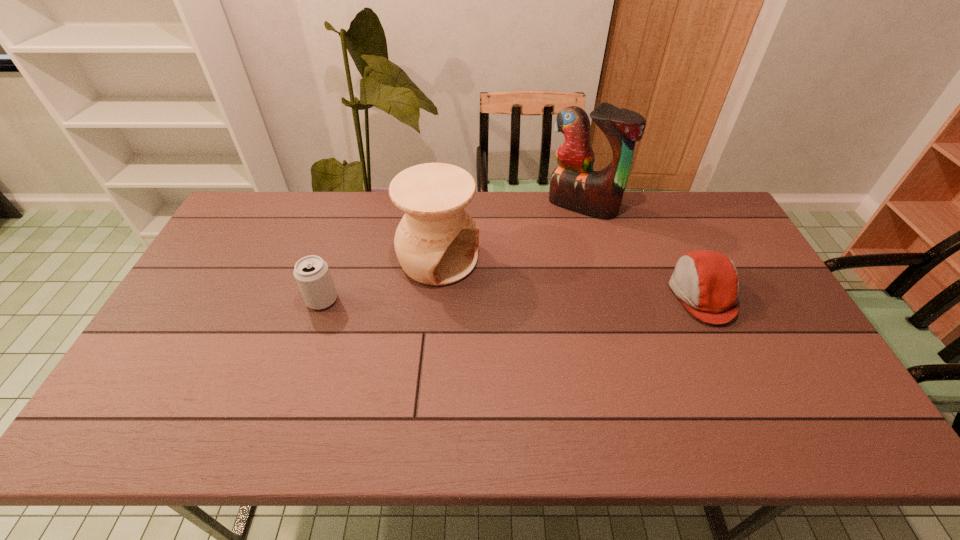
Find the location of a particular element. The width and height of the screenshot is (960, 540). vacant spot on the desktop that is between the third tallest object and the shortest object and is positioned at the open side of the second tallest object is located at coordinates (514, 297).

Where is `free space on the desktop that is between the can and the cap and is positioned at the face of the parrot`? The image size is (960, 540). free space on the desktop that is between the can and the cap and is positioned at the face of the parrot is located at coordinates (513, 297).